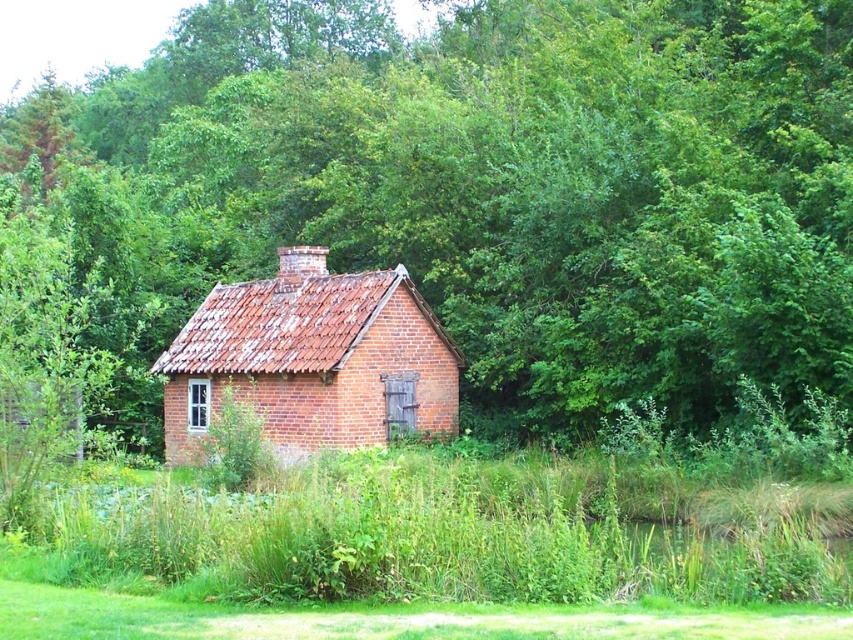
Question: Estimate the real-world distances between objects in this image. Which object is farther from the red brick cottage at center?

Choices:
 (A) green grass at center
 (B) green leafy tree at center

Answer: (B)

Question: Considering the relative positions of green leafy tree at center and red brick cottage at center in the image provided, where is green leafy tree at center located with respect to red brick cottage at center?

Choices:
 (A) above
 (B) below

Answer: (A)

Question: Which point appears farthest from the camera in this image?

Choices:
 (A) (805, 307)
 (B) (320, 442)
 (C) (419, 582)

Answer: (B)

Question: Does green grass at center appear on the right side of red brick cottage at center?

Choices:
 (A) no
 (B) yes

Answer: (B)

Question: Is green leafy tree at center in front of green grass at center?

Choices:
 (A) no
 (B) yes

Answer: (A)

Question: Which point is farther from the camera taking this photo?

Choices:
 (A) (213, 326)
 (B) (352, 136)
 (C) (235, 548)

Answer: (B)